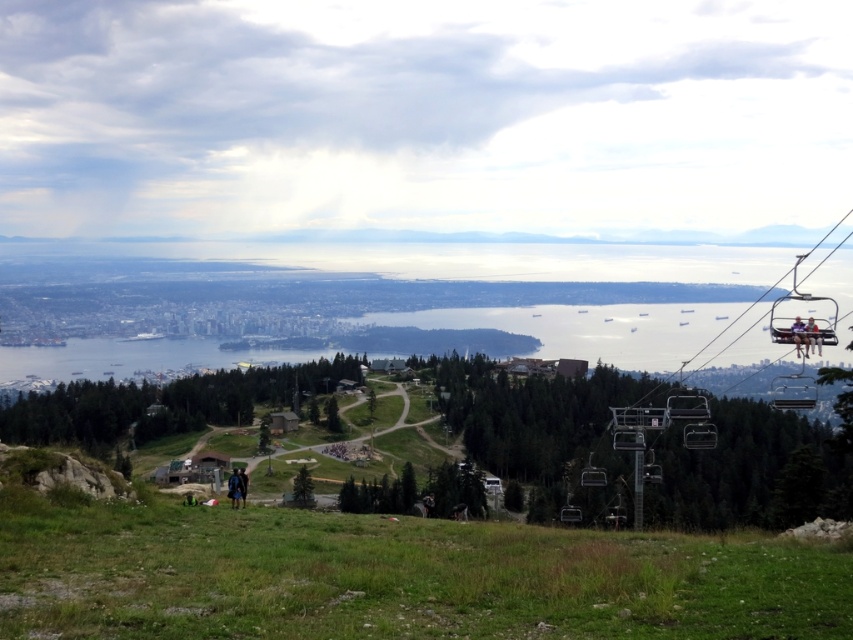
You are standing on the grassy hill and want to take a chairlift ride. Which chairlift is closer to you, the metallic silver ski lift at right or the matte black chairlift at lower center?

The matte black chairlift at lower center is closer to you because it is positioned at the lower center, which is nearer to your current position on the grassy hill compared to the metallic silver ski lift at right located further to the right side of the frame.

You are planning to take a photo of the light brown wooden chair at right and the dark blue jacket at lower center from the vantage point. Which object will appear smaller in the photo?

The light brown wooden chair at right will appear smaller in the photo because it is shorter than the dark blue jacket at lower center.

You are standing at a scenic overlook and see two points marked in the image. Which point is closer to you, point (699, 353) or point (561, 512)?

Point (561, 512) is closer to you because it is less further to the camera than point (699, 353).